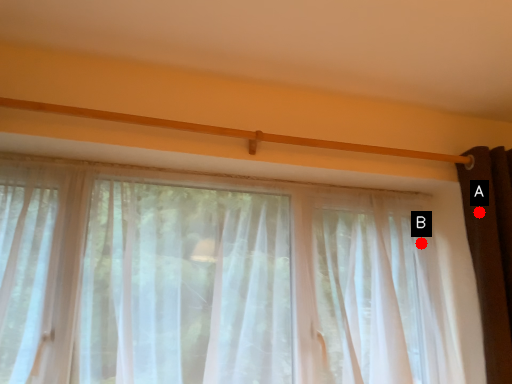
Question: Two points are circled on the image, labeled by A and B beside each circle. Which point is farther to the camera?

Choices:
 (A) A is further
 (B) B is further

Answer: (B)